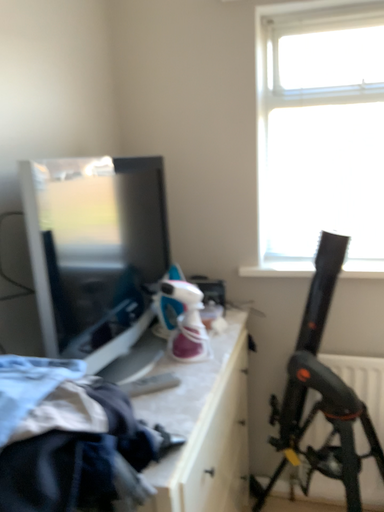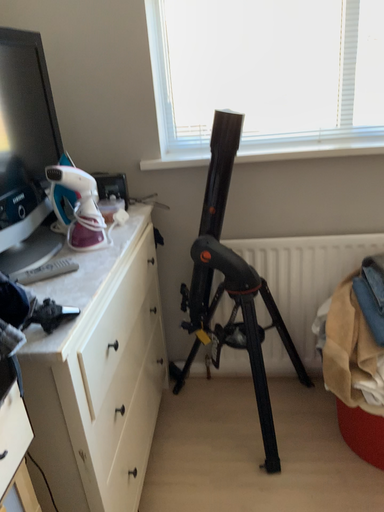
Question: Which way did the camera rotate in the video?

Choices:
 (A) rotated upward
 (B) rotated downward

Answer: (B)